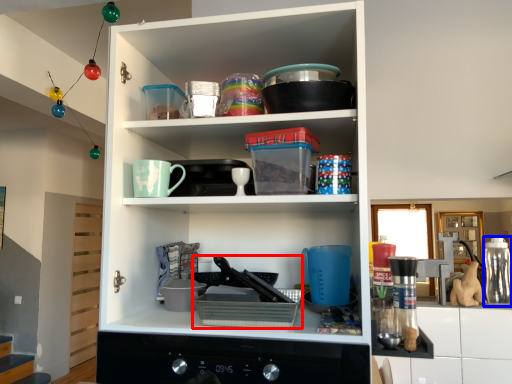
Question: Among these objects, which one is nearest to the camera, appliance (highlighted by a red box) or bottle (highlighted by a blue box)?

Choices:
 (A) appliance
 (B) bottle

Answer: (A)